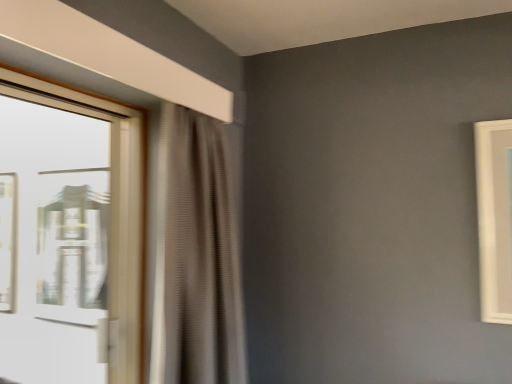
Question: Does clear glass window at left have a greater width compared to beige textured curtain at left?

Choices:
 (A) yes
 (B) no

Answer: (B)

Question: Considering the relative sizes of clear glass window at left and beige textured curtain at left in the image provided, is clear glass window at left smaller than beige textured curtain at left?

Choices:
 (A) yes
 (B) no

Answer: (A)

Question: Is clear glass window at left not inside beige textured curtain at left?

Choices:
 (A) yes
 (B) no

Answer: (A)

Question: Is clear glass window at left aimed at beige textured curtain at left?

Choices:
 (A) no
 (B) yes

Answer: (B)

Question: From a real-world perspective, is clear glass window at left on top of beige textured curtain at left?

Choices:
 (A) yes
 (B) no

Answer: (A)

Question: Is the depth of clear glass window at left less than that of beige textured curtain at left?

Choices:
 (A) yes
 (B) no

Answer: (A)

Question: Is beige textured curtain at left positioned with its back to clear glass window at left?

Choices:
 (A) yes
 (B) no

Answer: (A)

Question: Is beige textured curtain at left wider than clear glass window at left?

Choices:
 (A) yes
 (B) no

Answer: (A)

Question: From the image's perspective, is beige textured curtain at left under clear glass window at left?

Choices:
 (A) yes
 (B) no

Answer: (A)

Question: Is beige textured curtain at left to the left of clear glass window at left from the viewer's perspective?

Choices:
 (A) no
 (B) yes

Answer: (A)

Question: Is beige textured curtain at left positioned in front of clear glass window at left?

Choices:
 (A) no
 (B) yes

Answer: (A)

Question: Does beige textured curtain at left have a lesser width compared to clear glass window at left?

Choices:
 (A) yes
 (B) no

Answer: (B)

Question: From a real-world perspective, is beige textured curtain at left above or below clear glass window at left?

Choices:
 (A) below
 (B) above

Answer: (A)